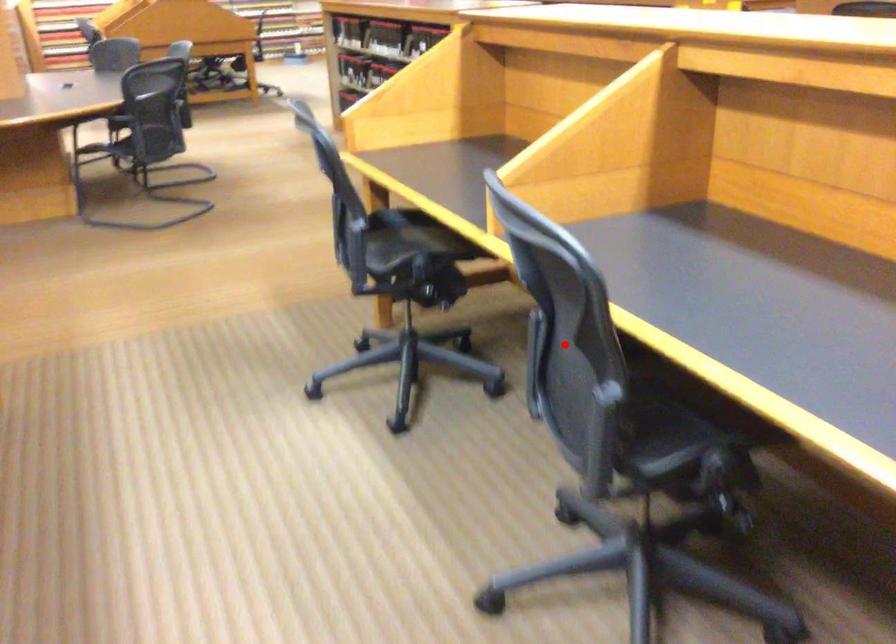
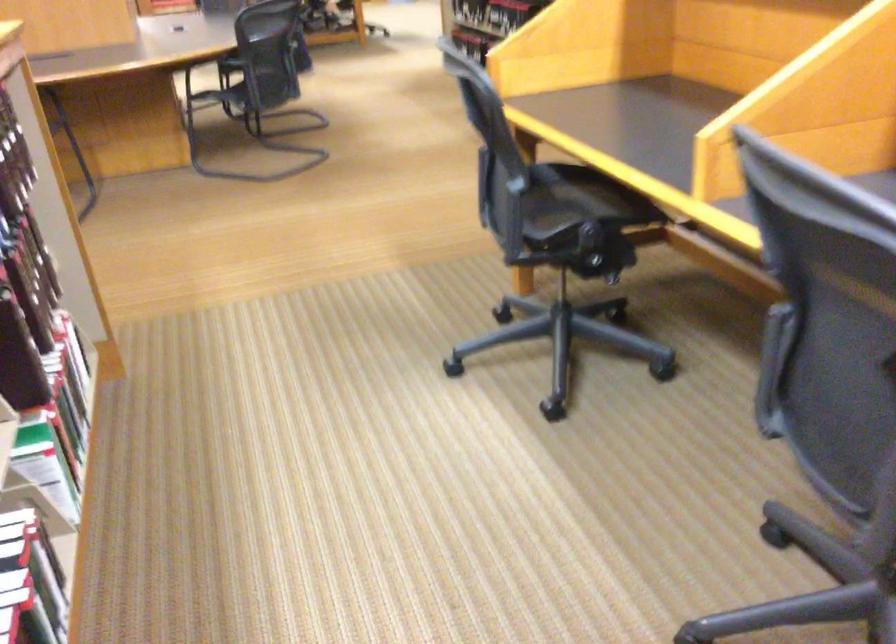
Find the pixel in the second image that matches the highlighted location in the first image.

(830, 341)